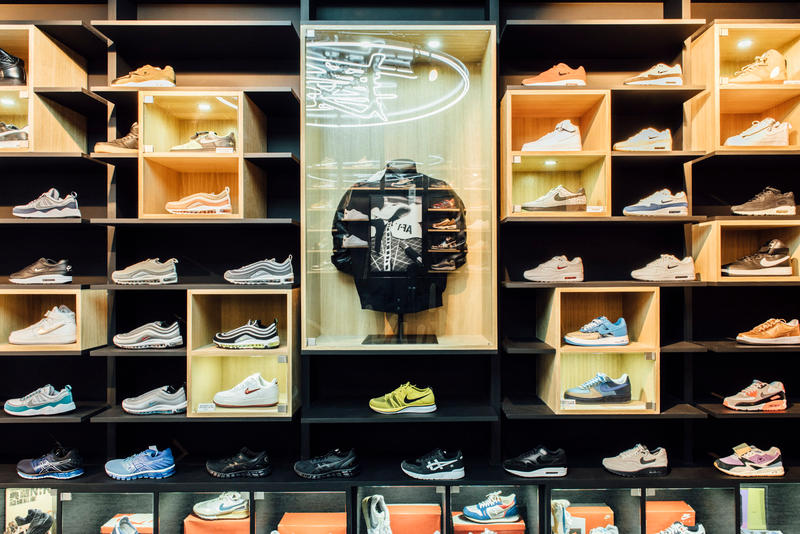
Where is `overhead lights`? overhead lights is located at coordinates (205, 109), (9, 104), (360, 43), (433, 42), (553, 164), (742, 40).